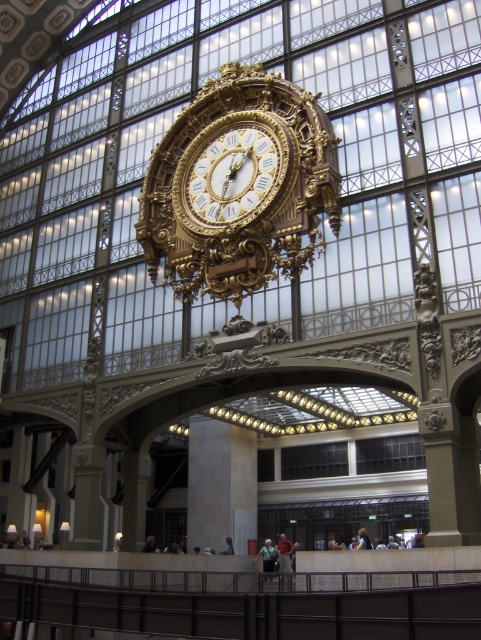
Question: Which object appears closest to the camera in this image?

Choices:
 (A) gold ornate clock at center
 (B) smooth concrete pillar at center
 (C) gold/gilded metal clock at center

Answer: (A)

Question: Which point appears closest to the camera in this image?

Choices:
 (A) (204, 268)
 (B) (265, 209)
 (C) (199, 486)

Answer: (B)

Question: Observing the image, what is the correct spatial positioning of gold/gilded metal clock at center in reference to smooth concrete pillar at center?

Choices:
 (A) left
 (B) right

Answer: (B)

Question: Is gold/gilded metal clock at center bigger than smooth concrete pillar at center?

Choices:
 (A) yes
 (B) no

Answer: (A)

Question: Does gold ornate clock at center come behind smooth concrete pillar at center?

Choices:
 (A) yes
 (B) no

Answer: (B)

Question: Which object appears farthest from the camera in this image?

Choices:
 (A) gold ornate clock at center
 (B) gold/gilded metal clock at center

Answer: (B)